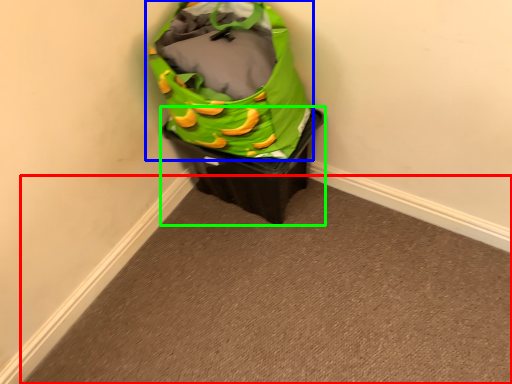
Question: Considering the real-world distances, which object is farthest from plain (highlighted by a red box)? luggage and bags (highlighted by a blue box) or waste container (highlighted by a green box)?

Choices:
 (A) luggage and bags
 (B) waste container

Answer: (A)